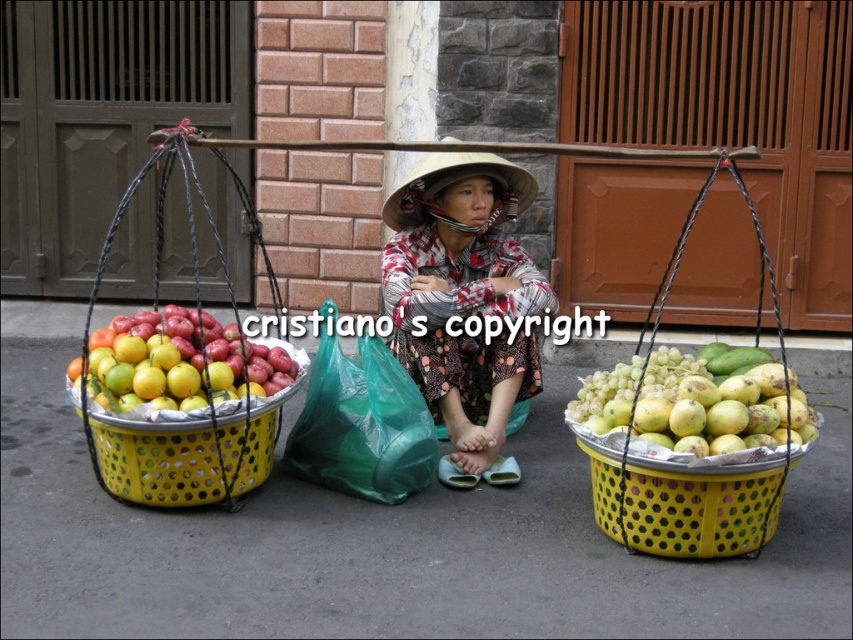
Which is in front, point (496, 301) or point (415, 220)?

Positioned in front is point (496, 301).

Consider the image. Between plaid fabric hat at center and straw hat at center, which one appears on the left side from the viewer's perspective?

straw hat at center

Is point (480, 406) more distant than point (413, 209)?

Yes, it is behind point (413, 209).

Identify the location of plaid fabric hat at center. Image resolution: width=853 pixels, height=640 pixels. (463, 294).

Between point (265, 465) and point (329, 449), which one is positioned in front?

Point (265, 465)

Is yellow plastic basket at left to the right of green plastic bag at center from the viewer's perspective?

In fact, yellow plastic basket at left is to the left of green plastic bag at center.

Between point (231, 481) and point (405, 470), which one is positioned behind?

Point (405, 470)

Locate an element on the screen. The width and height of the screenshot is (853, 640). yellow plastic basket at left is located at coordinates (198, 390).

Measure the distance between point (250,368) and camera.

They are 3.96 meters apart.

Does shiny metallic apples at left have a smaller size compared to straw hat at center?

Incorrect, shiny metallic apples at left is not smaller in size than straw hat at center.

Where is `shiny metallic apples at left`? shiny metallic apples at left is located at coordinates (177, 364).